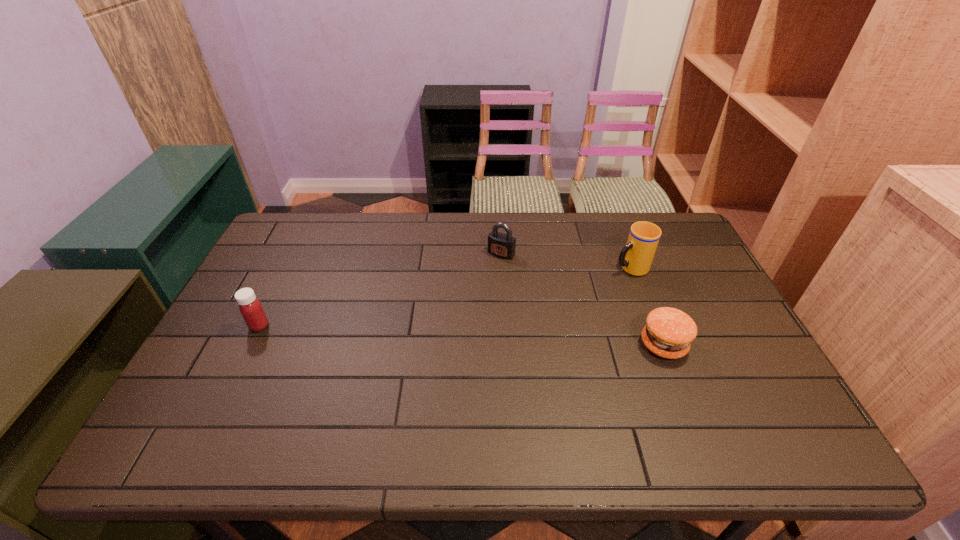
The width and height of the screenshot is (960, 540). In order to click on vacant space located 0.310m on the side of the tallest object with the handle in this screenshot , I will do coord(531,304).

At what (x,y) coordinates should I click in order to perform the action: click on free space located 0.390m on the side of the tallest object with the handle. Please return your answer as a coordinate pair (x, y). This screenshot has height=540, width=960. Looking at the image, I should click on (507, 314).

Image resolution: width=960 pixels, height=540 pixels. Identify the location of object that is at the far edge. (501, 245).

At what (x,y) coordinates should I click in order to perform the action: click on object present at the left edge. Please return your answer as a coordinate pair (x, y). Image resolution: width=960 pixels, height=540 pixels. Looking at the image, I should click on (250, 307).

The height and width of the screenshot is (540, 960). In the image, there is a desktop. Identify the location of free space at the far edge. (553, 212).

Find the location of a particular element. This screenshot has width=960, height=540. vacant space at the near edge is located at coordinates (331, 411).

This screenshot has width=960, height=540. In order to click on free region at the left edge of the desktop in this screenshot , I will do `click(250, 281)`.

The height and width of the screenshot is (540, 960). I want to click on vacant area at the right edge of the desktop, so click(x=747, y=350).

In the image, there is a desktop. Find the location of `vacant space at the near left corner`. vacant space at the near left corner is located at coordinates (203, 382).

Identify the location of vacant space at the near right corner of the desktop. Image resolution: width=960 pixels, height=540 pixels. (750, 411).